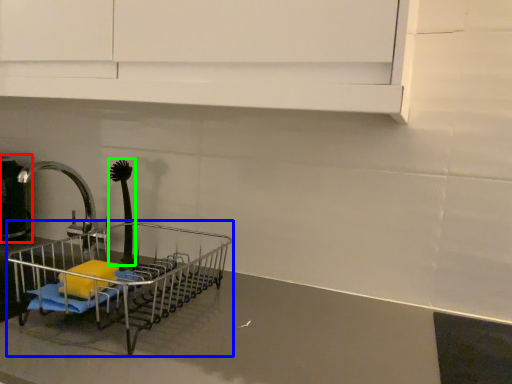
Question: Considering the real-world distances, which object is farthest from appliance (highlighted by a red box)? shopping cart (highlighted by a blue box) or brush (highlighted by a green box)?

Choices:
 (A) shopping cart
 (B) brush

Answer: (A)